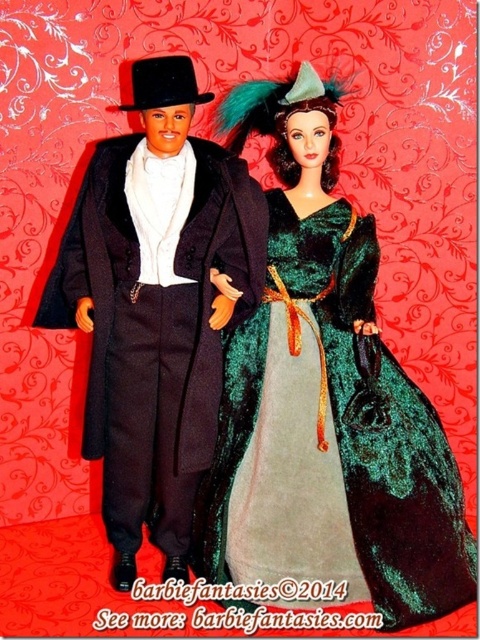
Which of these two, green velvet dress at center or matte black suit at center, stands taller?

matte black suit at center

Can you confirm if green velvet dress at center is positioned to the right of matte black suit at center?

Yes, green velvet dress at center is to the right of matte black suit at center.

Is point (429, 448) positioned behind point (110, 276)?

Yes, it is.

Where is `green velvet dress at center`? Image resolution: width=480 pixels, height=640 pixels. green velvet dress at center is located at coordinates (331, 440).